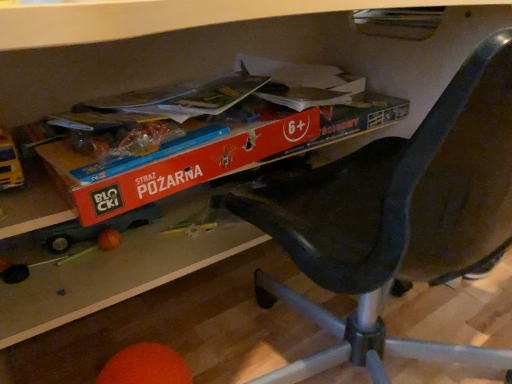
This screenshot has height=384, width=512. Find the location of `vacant point above red cardboard box at center (from a real-world perspective)`. vacant point above red cardboard box at center (from a real-world perspective) is located at coordinates (215, 96).